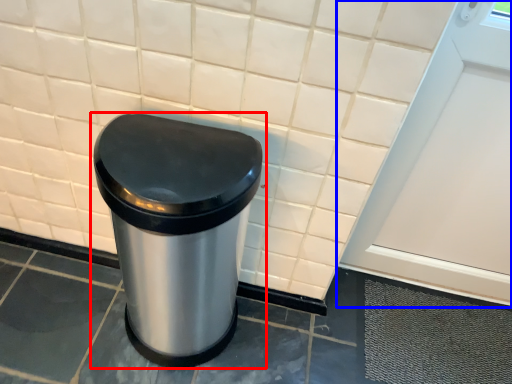
Question: Which point is closer to the camera, waste container (highlighted by a red box) or screen door (highlighted by a blue box)?

Choices:
 (A) waste container
 (B) screen door

Answer: (A)